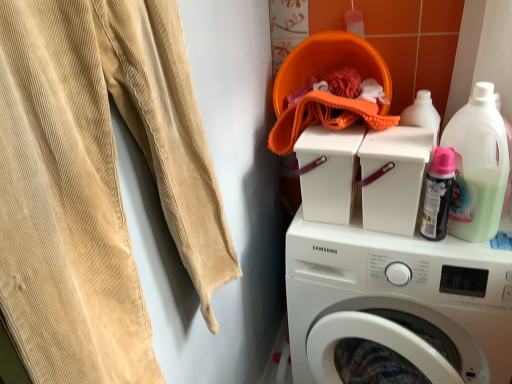
Find the location of a particular element. vacant area in front of white plastic container at center is located at coordinates (418, 249).